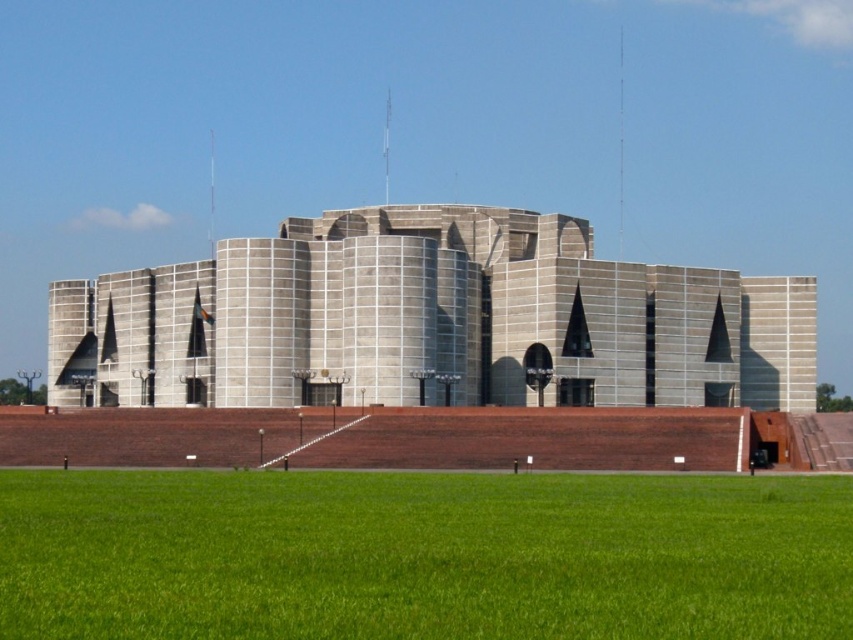
Between green grass at lower center and gray concrete building at center, which one is positioned lower?

green grass at lower center is lower down.

Does point (291, 508) lie behind point (349, 262)?

No, (291, 508) is closer to viewer.

Who is more distant from viewer, [73,500] or [149,365]?

Positioned behind is point [149,365].

Where is `green grass at lower center`? green grass at lower center is located at coordinates (422, 556).